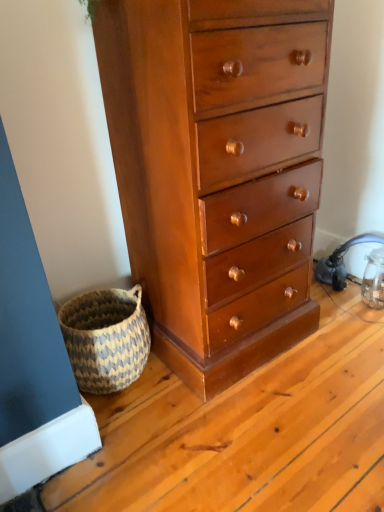
Where is `natural woven basket at lower left`? natural woven basket at lower left is located at coordinates (106, 338).

What do you see at coordinates (106, 338) in the screenshot? I see `natural woven basket at lower left` at bounding box center [106, 338].

You are a GUI agent. You are given a task and a screenshot of the screen. Output one action in this format:
    pyautogui.click(x=<x>, y=<y>)
    Task: Click on the shiny brown wood chest of drawers at center
    
    Given the screenshot: What is the action you would take?
    pyautogui.click(x=217, y=170)

Describe the element at coordinates (217, 170) in the screenshot. I see `shiny brown wood chest of drawers at center` at that location.

You are a GUI agent. You are given a task and a screenshot of the screen. Output one action in this format:
    pyautogui.click(x=<x>, y=<y>)
    Task: Click on the natural woven basket at lower left
    
    Given the screenshot: What is the action you would take?
    pyautogui.click(x=106, y=338)

Considering the relative positions of natural woven basket at lower left and shiny brown wood chest of drawers at center in the image provided, is natural woven basket at lower left to the left of shiny brown wood chest of drawers at center from the viewer's perspective?

Yes, natural woven basket at lower left is to the left of shiny brown wood chest of drawers at center.

Considering the positions of objects natural woven basket at lower left and shiny brown wood chest of drawers at center in the image provided, who is in front, natural woven basket at lower left or shiny brown wood chest of drawers at center?

shiny brown wood chest of drawers at center.

Which point is more forward, (x=99, y=319) or (x=112, y=10)?

The point (x=112, y=10) is closer.

From the image's perspective, between natural woven basket at lower left and shiny brown wood chest of drawers at center, which one is located above?

shiny brown wood chest of drawers at center appears higher in the image.

From a real-world perspective, is natural woven basket at lower left physically below shiny brown wood chest of drawers at center?

Yes, from a real-world perspective, natural woven basket at lower left is beneath shiny brown wood chest of drawers at center.

Which of these two, natural woven basket at lower left or shiny brown wood chest of drawers at center, is thinner?

natural woven basket at lower left.

Between natural woven basket at lower left and shiny brown wood chest of drawers at center, which one has more height?

With more height is shiny brown wood chest of drawers at center.

Does natural woven basket at lower left have a smaller size compared to shiny brown wood chest of drawers at center?

Indeed, natural woven basket at lower left has a smaller size compared to shiny brown wood chest of drawers at center.

Can shiny brown wood chest of drawers at center be found inside natural woven basket at lower left?

Actually, shiny brown wood chest of drawers at center is outside natural woven basket at lower left.

Is natural woven basket at lower left positioned far away from shiny brown wood chest of drawers at center?

natural woven basket at lower left is near shiny brown wood chest of drawers at center, not far away.

Is natural woven basket at lower left looking in the opposite direction of shiny brown wood chest of drawers at center?

No, shiny brown wood chest of drawers at center is not at the back of natural woven basket at lower left.

What's the angular difference between natural woven basket at lower left and shiny brown wood chest of drawers at center's facing directions?

5.38 degrees separate the facing orientations of natural woven basket at lower left and shiny brown wood chest of drawers at center.

How far apart are natural woven basket at lower left and shiny brown wood chest of drawers at center?

natural woven basket at lower left and shiny brown wood chest of drawers at center are 14.77 inches apart.

Find the location of `basket located behind the shiny brown wood chest of drawers at center`. basket located behind the shiny brown wood chest of drawers at center is located at coordinates (106, 338).

Which is more to the right, shiny brown wood chest of drawers at center or natural woven basket at lower left?

Positioned to the right is shiny brown wood chest of drawers at center.

Is shiny brown wood chest of drawers at center further to the viewer compared to natural woven basket at lower left?

No.

Considering the positions of point (227, 279) and point (99, 325), is point (227, 279) closer or farther from the camera than point (99, 325)?

Point (227, 279) is closer to the camera than point (99, 325).

From the image's perspective, which is below, shiny brown wood chest of drawers at center or natural woven basket at lower left?

natural woven basket at lower left appears lower in the image.

From a real-world perspective, is shiny brown wood chest of drawers at center above or below natural woven basket at lower left?

shiny brown wood chest of drawers at center is situated higher than natural woven basket at lower left in the real world.

In the scene shown: Does shiny brown wood chest of drawers at center have a greater width compared to natural woven basket at lower left?

Correct, the width of shiny brown wood chest of drawers at center exceeds that of natural woven basket at lower left.

Considering the relative sizes of shiny brown wood chest of drawers at center and natural woven basket at lower left in the image provided, is shiny brown wood chest of drawers at center shorter than natural woven basket at lower left?

Incorrect, the height of shiny brown wood chest of drawers at center does not fall short of that of natural woven basket at lower left.

Is shiny brown wood chest of drawers at center bigger than natural woven basket at lower left?

Indeed, shiny brown wood chest of drawers at center has a larger size compared to natural woven basket at lower left.

Is shiny brown wood chest of drawers at center inside the boundaries of natural woven basket at lower left, or outside?

shiny brown wood chest of drawers at center is not inside natural woven basket at lower left, it's outside.

Is shiny brown wood chest of drawers at center touching natural woven basket at lower left?

They are not placed beside each other.

Is natural woven basket at lower left at the back of shiny brown wood chest of drawers at center?

That's not correct — shiny brown wood chest of drawers at center is not looking away from natural woven basket at lower left.

Measure the distance from shiny brown wood chest of drawers at center to natural woven basket at lower left.

A distance of 14.77 inches exists between shiny brown wood chest of drawers at center and natural woven basket at lower left.

The width and height of the screenshot is (384, 512). Find the location of `basket behind the shiny brown wood chest of drawers at center`. basket behind the shiny brown wood chest of drawers at center is located at coordinates (106, 338).

Image resolution: width=384 pixels, height=512 pixels. Identify the location of basket on the left side of shiny brown wood chest of drawers at center. (106, 338).

You are a GUI agent. You are given a task and a screenshot of the screen. Output one action in this format:
    pyautogui.click(x=<x>, y=<y>)
    Task: Click on the basket that is below the shiny brown wood chest of drawers at center (from the image's perspective)
    Image resolution: width=384 pixels, height=512 pixels.
    Given the screenshot: What is the action you would take?
    pyautogui.click(x=106, y=338)